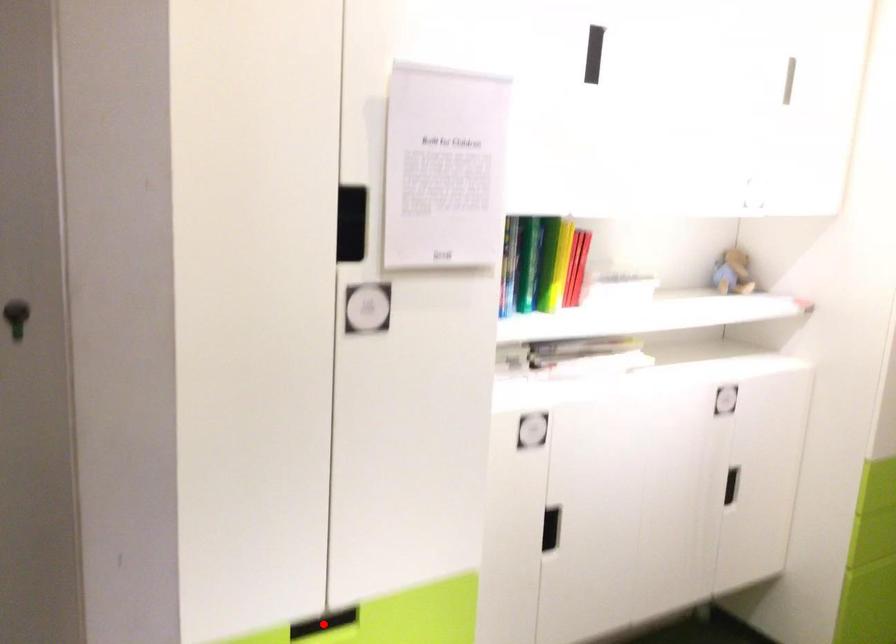
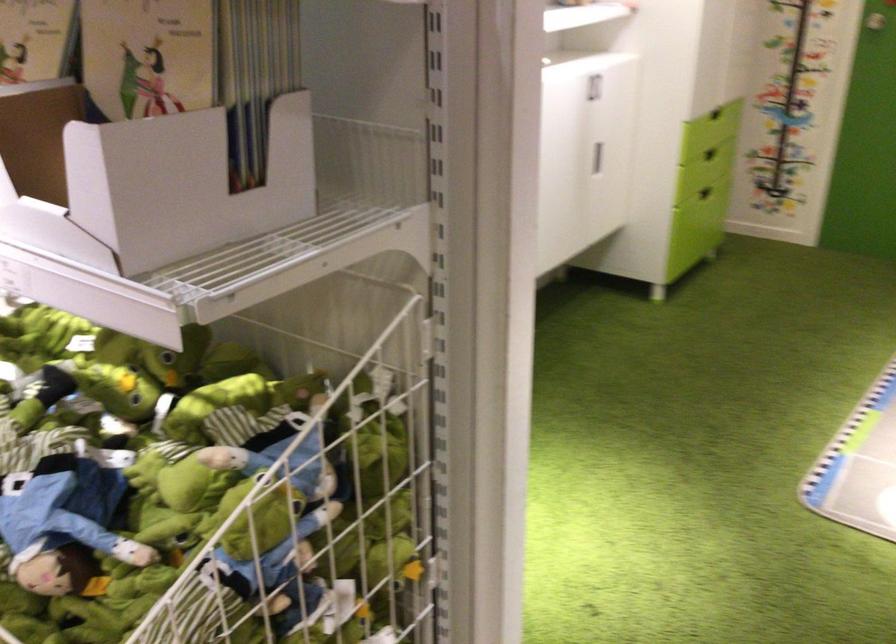
Question: I am providing you with two images of the same scene from different viewpoints. A red point is marked on the first image. At the location where the point appears in image 1, is it still visible in image 2?

Choices:
 (A) Yes
 (B) No

Answer: (B)